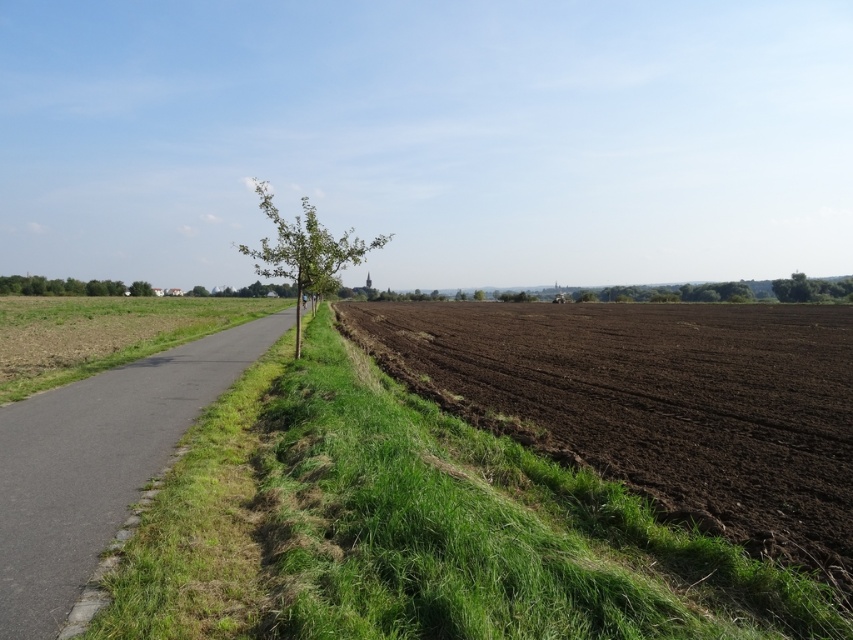
Question: Can you confirm if green grass at lower left is positioned to the right of asphalt road at center?

Choices:
 (A) yes
 (B) no

Answer: (A)

Question: Considering the real-world distances, which object is closest to the green leafy tree at left?

Choices:
 (A) asphalt road at center
 (B) green leafy tree at center
 (C) green grass at lower left
 (D) green leafy tree at upper right

Answer: (B)

Question: Is green grass at lower left further to the viewer compared to asphalt road at center?

Choices:
 (A) no
 (B) yes

Answer: (A)

Question: Considering the relative positions of green grass at lower left and green leafy tree at center in the image provided, where is green grass at lower left located with respect to green leafy tree at center?

Choices:
 (A) left
 (B) right

Answer: (B)

Question: Which object appears farthest from the camera in this image?

Choices:
 (A) green leafy tree at left
 (B) green grass at lower left
 (C) green leafy tree at upper right
 (D) asphalt road at center

Answer: (A)

Question: Among these points, which one is farthest from the camera?

Choices:
 (A) pos(163,515)
 (B) pos(256,268)
 (C) pos(44,282)

Answer: (C)